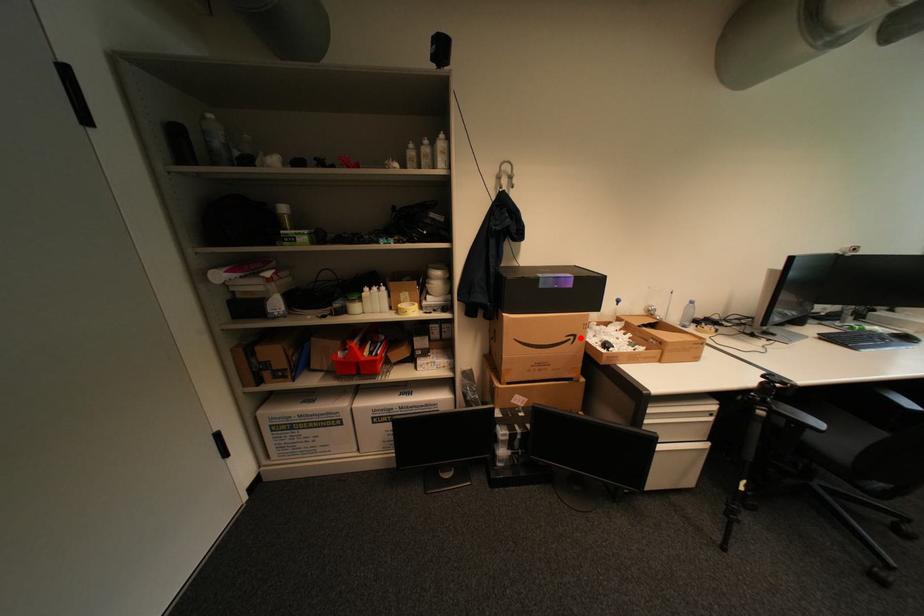
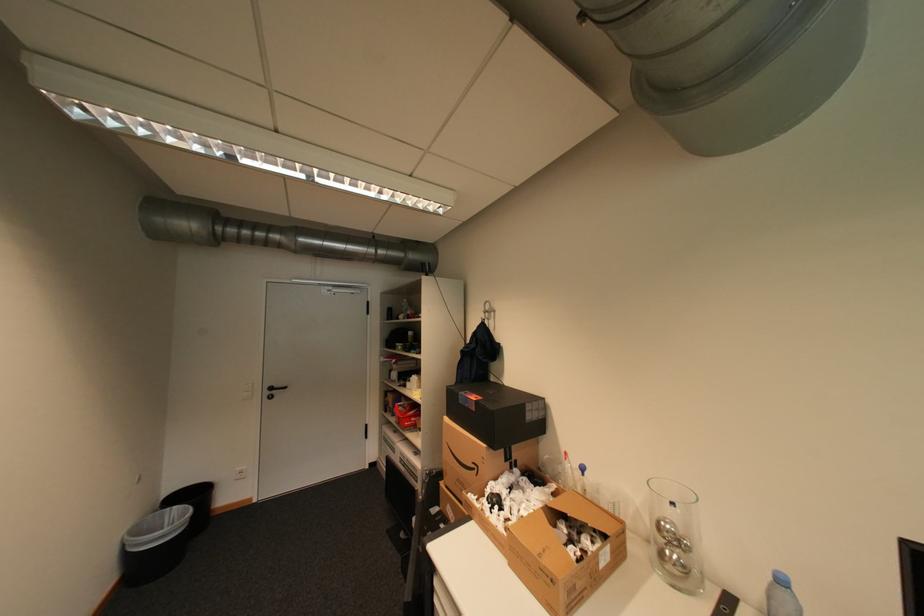
Question: A red point is marked in image1. In image2, is the corresponding 3D point closer to the camera or farther? Reply with the corresponding letter.

Choices:
 (A) The corresponding 3D point is closer.
 (B) The corresponding 3D point is farther.

Answer: (B)